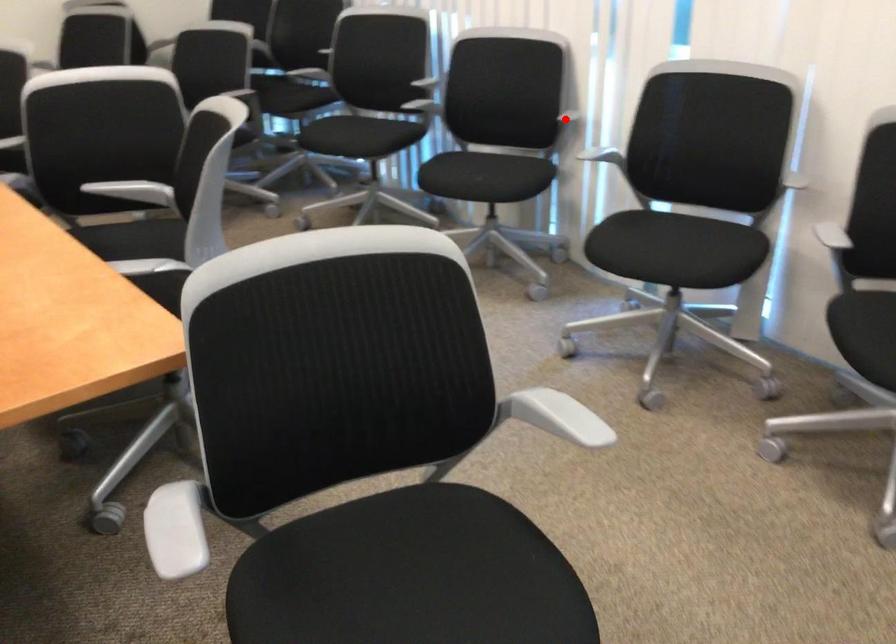
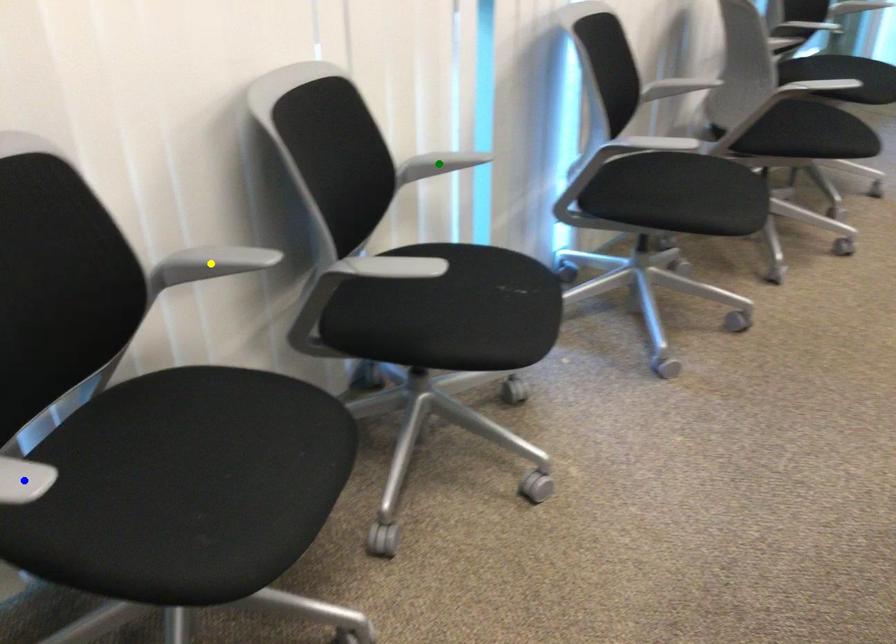
Question: I am providing you with two images of the same scene from different viewpoints. A red point is marked on the first image. You are given multiple points on the second image. Which spot in image 2 lines up with the point in image 1?

Choices:
 (A) blue point
 (B) yellow point
 (C) green point

Answer: (C)